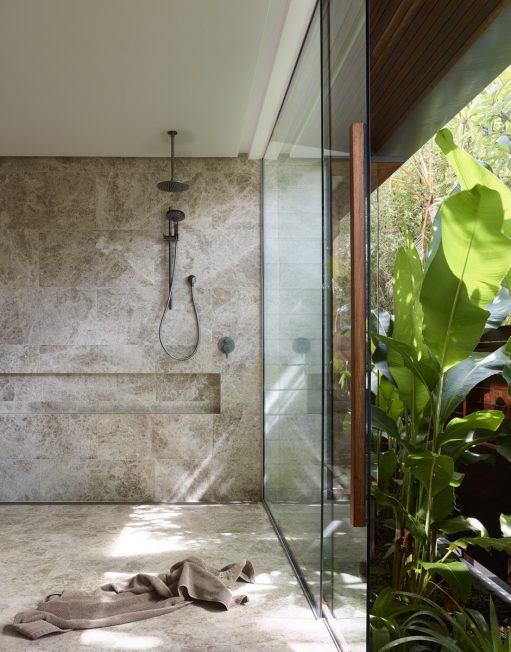
You are a GUI agent. You are given a task and a screenshot of the screen. Output one action in this format:
    pyautogui.click(x=<x>, y=<y>)
    Task: Click on the ceiling
    The height and width of the screenshot is (652, 511).
    Given the screenshot: What is the action you would take?
    click(x=85, y=87)